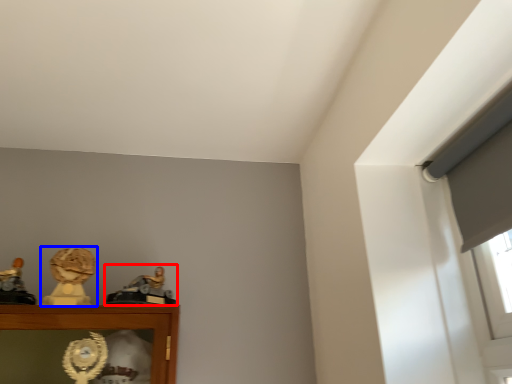
Question: Which object appears closest to the camera in this image, character sculpture (highlighted by a red box) or character sculpture (highlighted by a blue box)?

Choices:
 (A) character sculpture
 (B) character sculpture

Answer: (A)